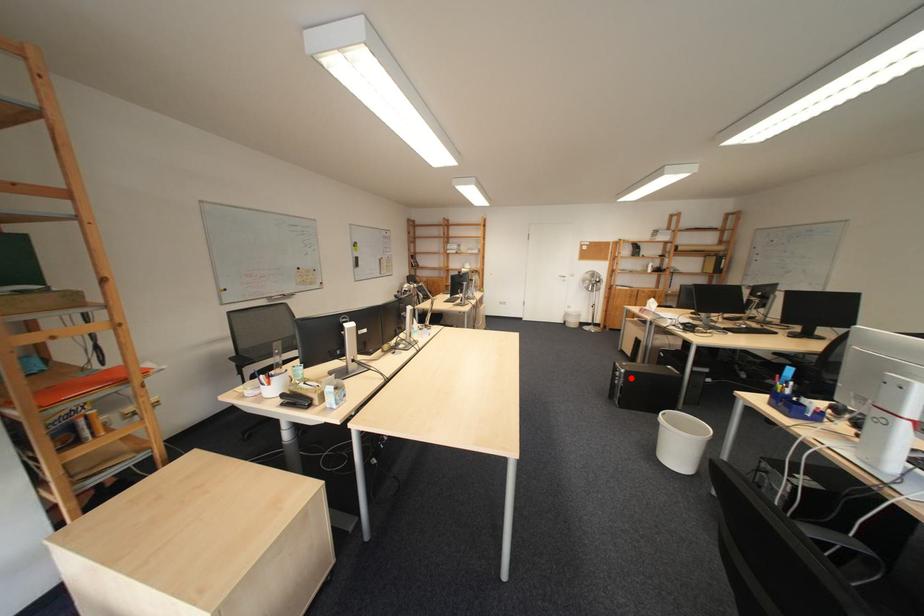
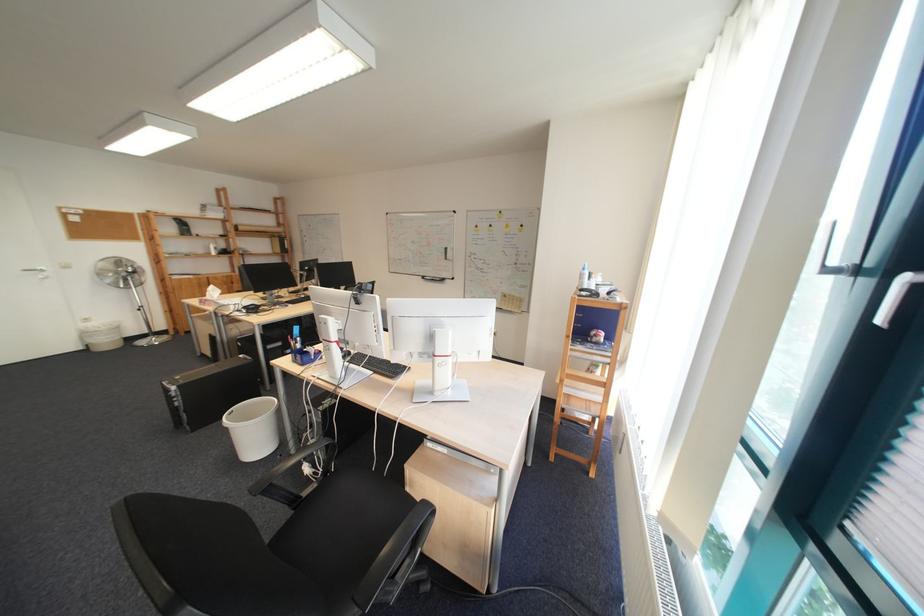
Question: A red point is marked in image1. In image2, is the corresponding 3D point closer to the camera or farther? Reply with the corresponding letter.

Choices:
 (A) The corresponding 3D point is closer.
 (B) The corresponding 3D point is farther.

Answer: (A)